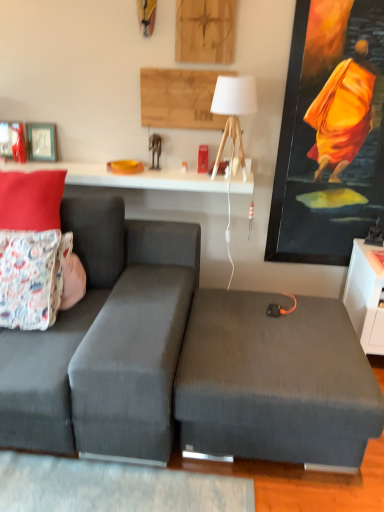
Question: Is dark gray fabric couch at left spatially inside dark gray fabric ottoman at center, or outside of it?

Choices:
 (A) outside
 (B) inside

Answer: (A)

Question: Is dark gray fabric couch at left in front of or behind dark gray fabric ottoman at center in the image?

Choices:
 (A) behind
 (B) front

Answer: (B)

Question: Estimate the real-world distances between objects in this image. Which object is farther from the matte black picture frame at upper left, the 1th picture frame from the right?

Choices:
 (A) dark gray fabric couch at left
 (B) white glossy table at upper center
 (C) floral fabric pillow at left, which is the 1th pillow from bottom to top
 (D) matte black picture frame at upper left, which ranks as the 1th picture frame in left-to-right order
 (E) matte fabric pillow at upper left, positioned as the 2th pillow in bottom-to-top order

Answer: (A)

Question: Considering the real-world distances, which object is farthest from the white glossy table at upper center?

Choices:
 (A) dark gray fabric couch at left
 (B) dark gray fabric ottoman at center
 (C) floral fabric pillow at left, which is the 1th pillow from bottom to top
 (D) matte black picture frame at upper left, the 1th picture frame from the right
 (E) white matte table lamp at upper center

Answer: (B)